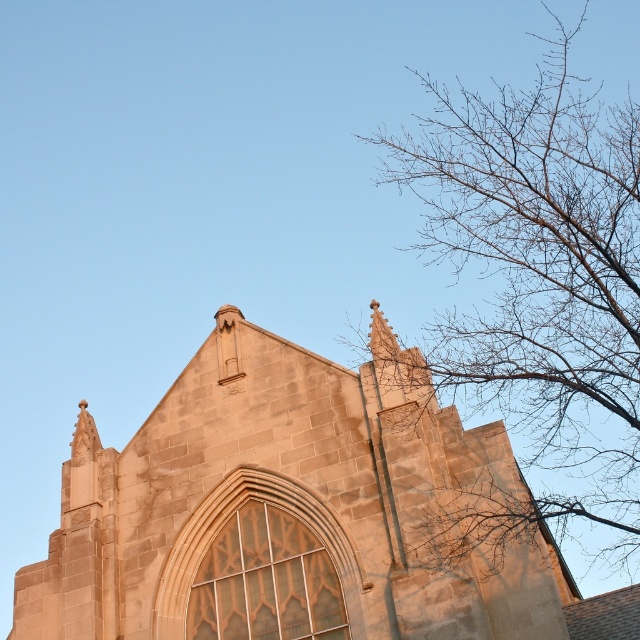
In the scene shown: You are an architect analyzing the structure of the stone church at center and the bare branches at upper right. Based on their positions, which object is closer to the viewer?

The bare branches at upper right are closer to the viewer than the stone church at center because the stone church at center is positioned under them.

You are an architect analyzing the height of structures in the image. Given that the stone church at center is a Gothic building, and the bare branches at upper right are part of a tree, which one has a greater height?

The bare branches at upper right are taller than the stone church at center.